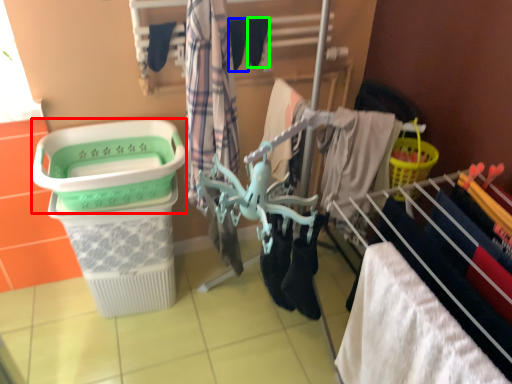
Question: Estimate the real-world distances between objects in this image. Which object is closer to basket container (highlighted by a red box), shoe (highlighted by a blue box) or shoe (highlighted by a green box)?

Choices:
 (A) shoe
 (B) shoe

Answer: (A)